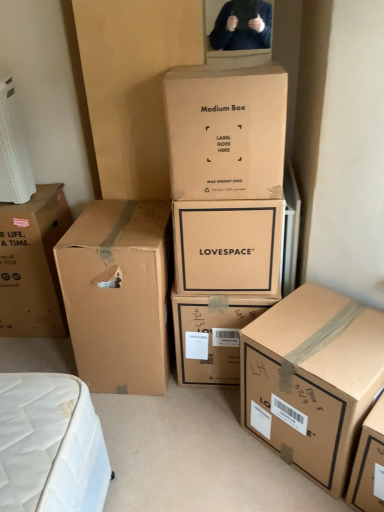
This screenshot has width=384, height=512. I want to click on unoccupied area in front of brown cardboard box at left, arranged as the fifth box when viewed from the right, so click(157, 425).